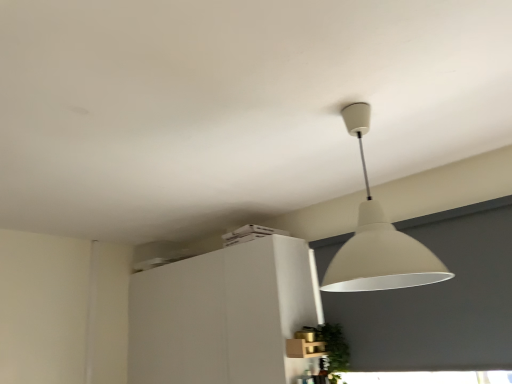
Question: Considering the positions of green leafy plant at lower right and white matte cabinet at upper center in the image, is green leafy plant at lower right wider or thinner than white matte cabinet at upper center?

Choices:
 (A) wide
 (B) thin

Answer: (B)

Question: From a real-world perspective, relative to white matte cabinet at upper center, is green leafy plant at lower right vertically above or below?

Choices:
 (A) above
 (B) below

Answer: (B)

Question: Which is nearer to the green leafy plant at lower right?

Choices:
 (A) white matte cabinet at upper center
 (B) matte white lampshade at upper center

Answer: (A)

Question: Which object is the closest to the white matte cabinet at upper center?

Choices:
 (A) matte white lampshade at upper center
 (B) green leafy plant at lower right

Answer: (B)